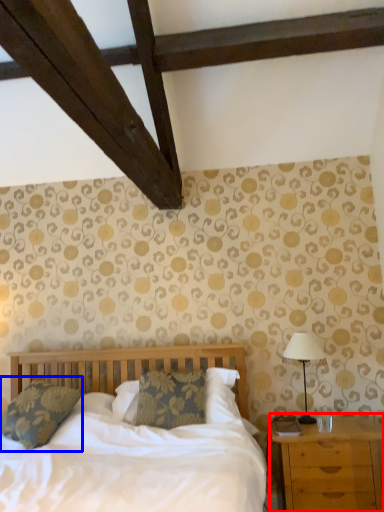
Question: Which point is closer to the camera, nightstand (highlighted by a red box) or pillow (highlighted by a blue box)?

Choices:
 (A) nightstand
 (B) pillow

Answer: (A)